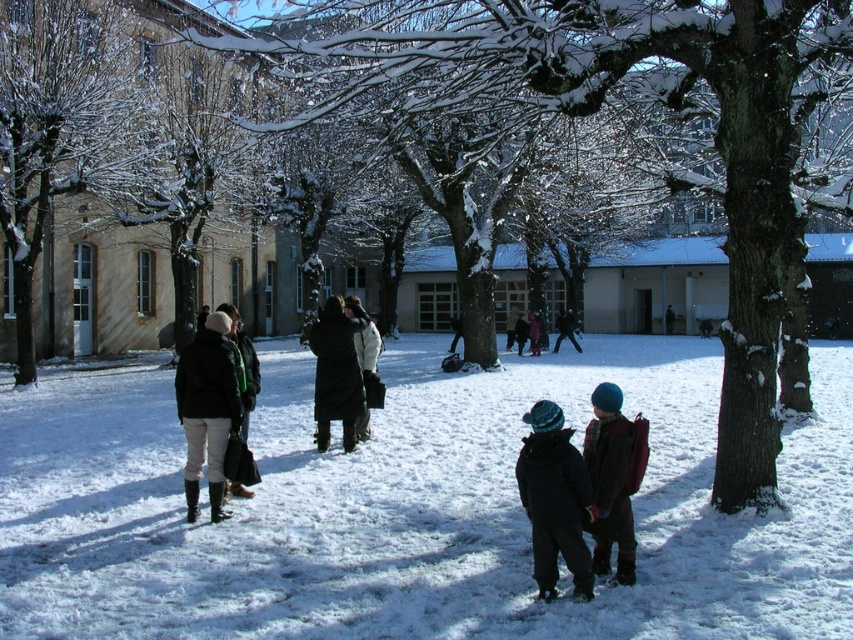
You are a photographer standing in the schoolyard and want to take a photo of the black wool coat at center and the dark gray jacket at center. Which one is closer to the camera?

The black wool coat at center is positioned under the dark gray jacket at center, so the dark gray jacket at center is closer to the camera.

You are a photographer trying to capture both the black wool coat at center and the dark gray jacket at center in a single shot. Given their sizes, which one might you need to position closer to the camera to ensure both fit in the frame?

The black wool coat at center occupies less space than the dark gray jacket at center, so you should position the black wool coat at center closer to the camera to ensure both fit in the frame.

You are a photographer trying to capture a closeup of the dark blue knit hat at lower center and the dark gray wool coat at center. Since your camera can only focus on one object at a time, which object should you choose to ensure the subject is in focus if you want to emphasize the size difference between them?

The dark blue knit hat at lower center has a larger width than the dark gray wool coat at center, so to emphasize the size difference, you should focus on the dark blue knit hat at lower center as it is bigger and will stand out more in the closeup.